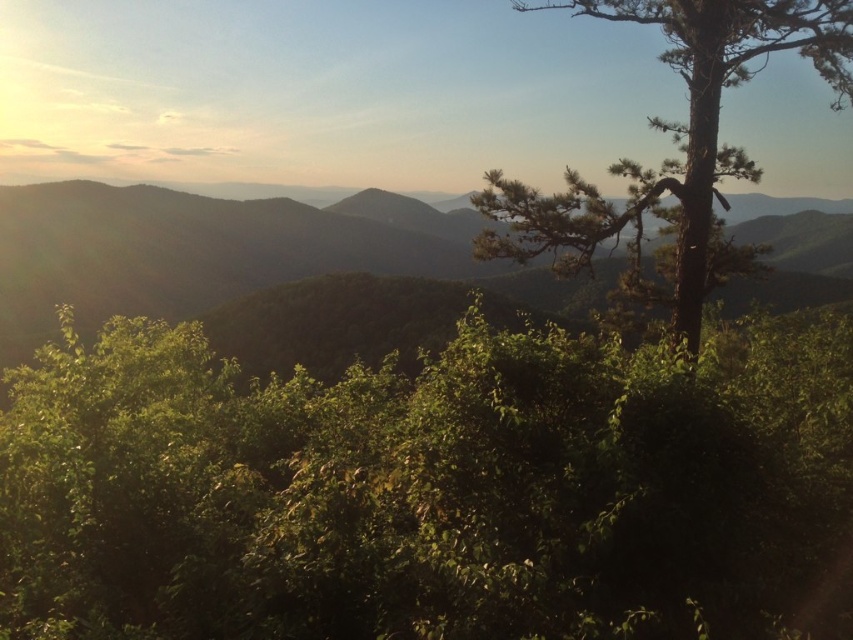
You are planning to plant a new tree in the landscape. The new tree requires a minimum of 300 feet of space between it and any existing trees or hills to ensure proper growth. Given the current spacing between the green leafy tree at center and the green matte hill at center, can you plant the new tree between them?

The green leafy tree at center and the green matte hill at center are 293.03 feet apart. Since the required minimum spacing is 300 feet, planting a new tree between them would not meet the requirement as the existing distance is insufficient.

In the scene shown: Based on the scene, which object is positioned lower in the image, the green leafy vegetation at center or the green matte hill at center?

The green leafy vegetation at center is positioned below the green matte hill at center, so it is lower in the image.

You are standing in the serene landscape scene and want to walk from the point closer to you to the point farther away. Which path should you take between point (677, 449) and point (677, 134)?

You should walk from point (677, 449) to point (677, 134) because point (677, 449) is closer to the viewer and point (677, 134) is farther away.